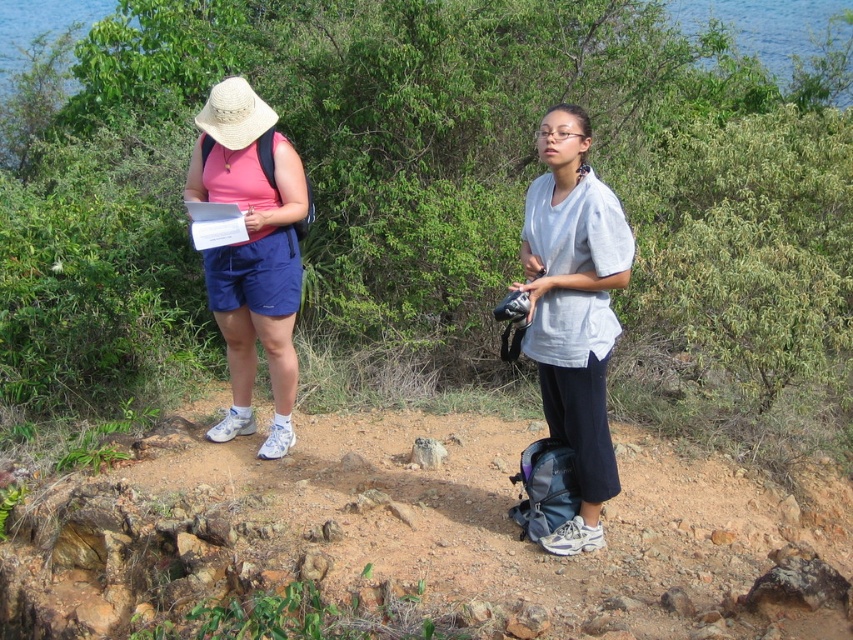
Question: Which point is closer to the camera?

Choices:
 (A) light gray cotton shirt at center
 (B) matte pink shirt at left

Answer: (A)

Question: Does light gray cotton shirt at center appear on the left side of matte pink shirt at left?

Choices:
 (A) no
 (B) yes

Answer: (A)

Question: Which of the following is the closest to the observer?

Choices:
 (A) (250, 410)
 (B) (541, 364)

Answer: (B)

Question: Is light gray cotton shirt at center bigger than matte pink shirt at left?

Choices:
 (A) no
 (B) yes

Answer: (A)

Question: Is light gray cotton shirt at center further to camera compared to matte pink shirt at left?

Choices:
 (A) yes
 (B) no

Answer: (B)